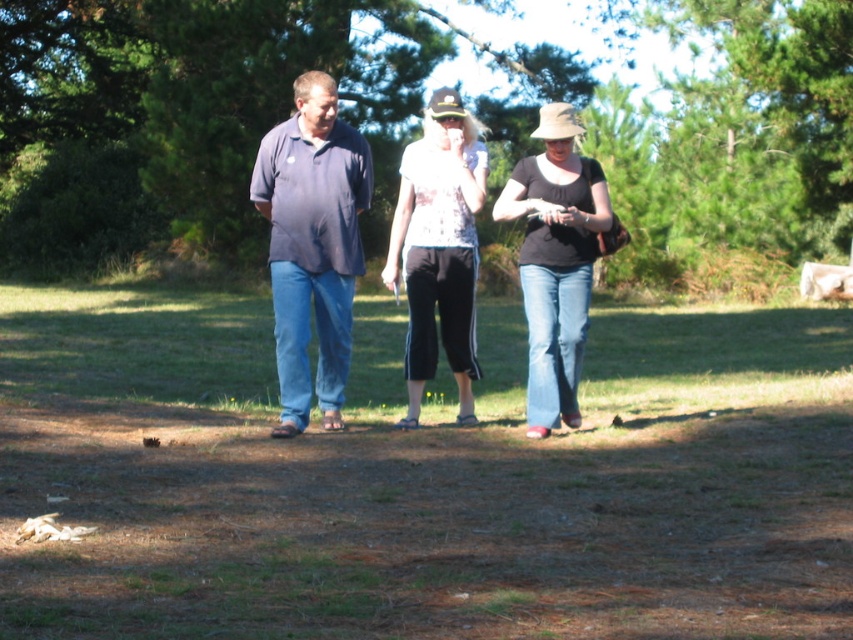
You are standing in the park and see the green leafy tree at upper center and the white printed blouse at center. Which object is positioned to the left of the other?

The green leafy tree at upper center is to the left of the white printed blouse at center.

You are a photographer trying to capture a group photo of the three people walking in the park. Since you want to ensure that the white printed blouse at center and the black matte shirt at center are clearly visible in the photo, which clothing item should you focus on to ensure both are in frame?

The white printed blouse at center is smaller than the black matte shirt at center, so focusing on the black matte shirt at center will help ensure both are in frame as the larger item will be easier to spot and frame.

You are standing in the park and want to take a photo of the white printed blouse at center without the green leafy tree at upper center blocking it. How should you position yourself?

Move to the side so that the white printed blouse at center is no longer aligned with the green leafy tree at upper center behind it.